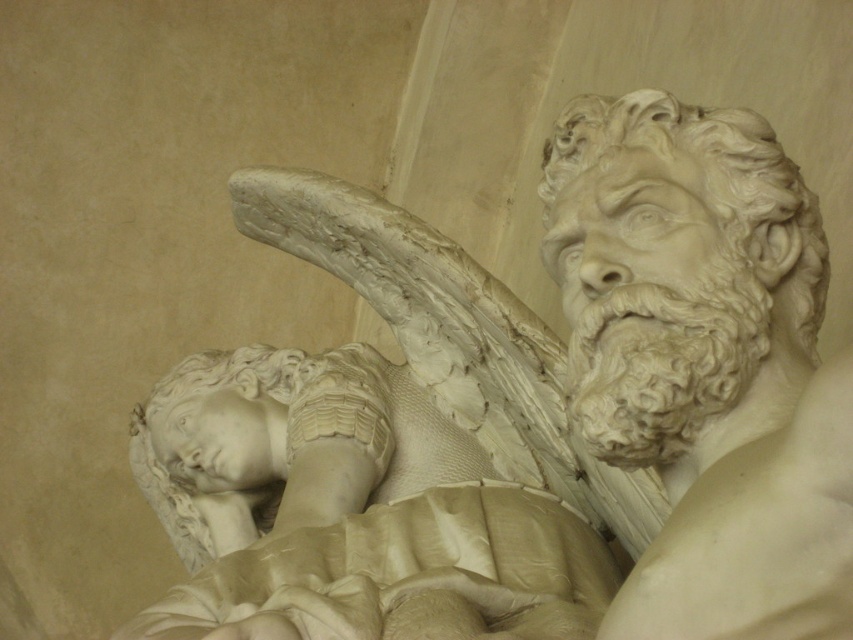
Between white marble head at upper right and white marble head at lower left, which one is positioned lower?

Positioned lower is white marble head at lower left.

Is white marble head at upper right behind white marble head at lower left?

No, it is not.

Is point (650, 444) behind point (264, 397)?

No, (650, 444) is closer to viewer.

Locate an element on the screen. This screenshot has height=640, width=853. white marble head at upper right is located at coordinates click(x=689, y=275).